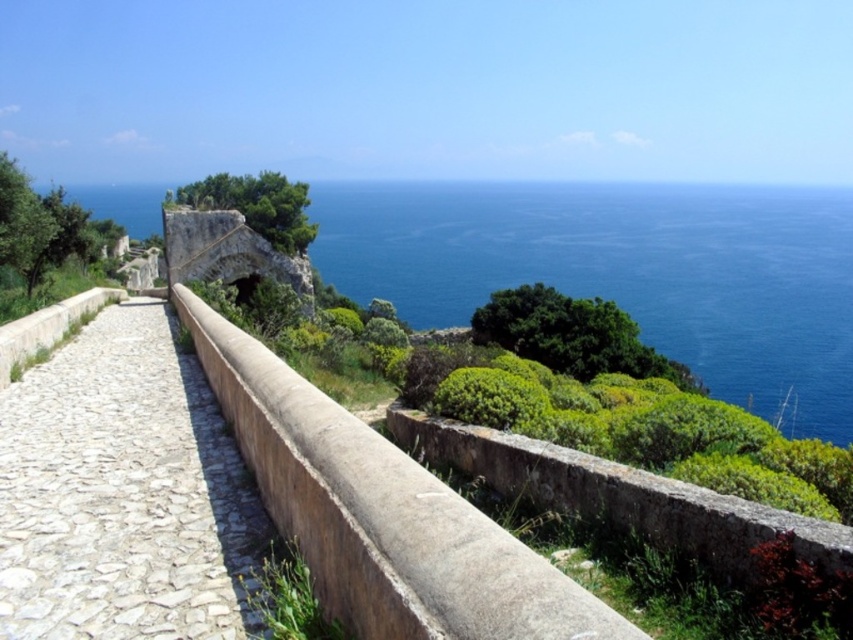
Question: Is stone paved path at left to the right of brown stone ledge at center from the viewer's perspective?

Choices:
 (A) no
 (B) yes

Answer: (A)

Question: Estimate the real-world distances between objects in this image. Which object is closer to the stone paved path at left?

Choices:
 (A) brown stone ledge at center
 (B) blue water at center

Answer: (A)

Question: Considering the relative positions of blue water at center and stone paved path at left in the image provided, where is blue water at center located with respect to stone paved path at left?

Choices:
 (A) left
 (B) right

Answer: (B)

Question: Does blue water at center appear over stone paved path at left?

Choices:
 (A) yes
 (B) no

Answer: (A)

Question: Which point is closer to the camera taking this photo?

Choices:
 (A) (53, 397)
 (B) (440, 499)

Answer: (B)

Question: Among these objects, which one is nearest to the camera?

Choices:
 (A) blue water at center
 (B) stone paved path at left

Answer: (B)